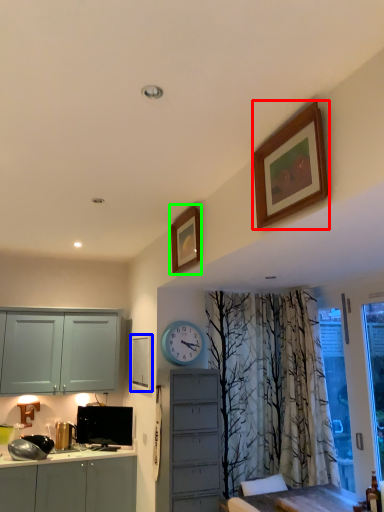
Question: Considering the real-world distances, which object is closest to picture frame (highlighted by a red box)? picture frame (highlighted by a blue box) or picture frame (highlighted by a green box).

Choices:
 (A) picture frame
 (B) picture frame

Answer: (B)